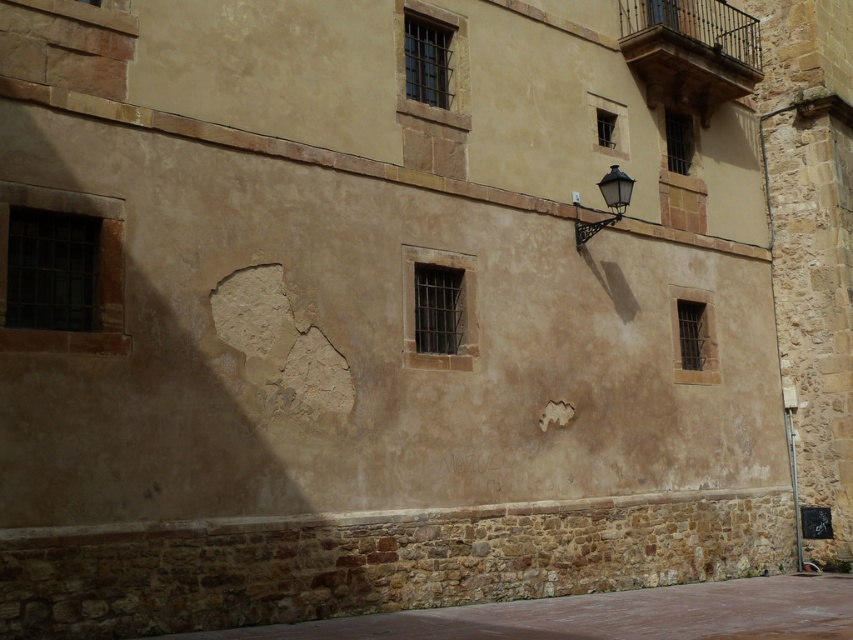
What do you see at coordinates (606, 616) in the screenshot?
I see `brown stone alley at lower center` at bounding box center [606, 616].

Between brown stone alley at lower center and black metal streetlamp at upper right, which one has more height?

brown stone alley at lower center

This screenshot has width=853, height=640. I want to click on brown stone alley at lower center, so click(606, 616).

The height and width of the screenshot is (640, 853). Find the location of `brown stone alley at lower center`. brown stone alley at lower center is located at coordinates (606, 616).